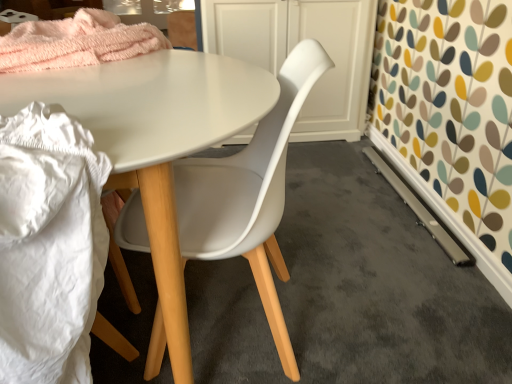
Question: Is white plastic chair at center positioned with its back to white matte cabinet at center?

Choices:
 (A) no
 (B) yes

Answer: (A)

Question: Is white plastic chair at center not near white matte cabinet at center?

Choices:
 (A) yes
 (B) no

Answer: (A)

Question: From the image's perspective, is white plastic chair at center above white matte cabinet at center?

Choices:
 (A) no
 (B) yes

Answer: (A)

Question: Does white plastic chair at center come in front of white matte cabinet at center?

Choices:
 (A) yes
 (B) no

Answer: (A)

Question: Considering the relative sizes of white plastic chair at center and white matte cabinet at center in the image provided, is white plastic chair at center smaller than white matte cabinet at center?

Choices:
 (A) yes
 (B) no

Answer: (A)

Question: Is white matte cabinet at center spatially inside white fabric at lower left, or outside of it?

Choices:
 (A) outside
 (B) inside

Answer: (A)

Question: Is point (323, 1) positioned closer to the camera than point (98, 160)?

Choices:
 (A) closer
 (B) farther

Answer: (B)

Question: Looking at the image, does white matte cabinet at center seem bigger or smaller compared to white fabric at lower left?

Choices:
 (A) big
 (B) small

Answer: (A)

Question: Is white matte cabinet at center wider or thinner than white fabric at lower left?

Choices:
 (A) thin
 (B) wide

Answer: (A)

Question: Considering the positions of white plastic chair at center and white fabric at lower left in the image, is white plastic chair at center wider or thinner than white fabric at lower left?

Choices:
 (A) thin
 (B) wide

Answer: (A)

Question: From a real-world perspective, is white plastic chair at center positioned above or below white fabric at lower left?

Choices:
 (A) above
 (B) below

Answer: (B)

Question: Is white plastic chair at center situated inside white fabric at lower left or outside?

Choices:
 (A) inside
 (B) outside

Answer: (B)

Question: Is white plastic chair at center bigger or smaller than white fabric at lower left?

Choices:
 (A) small
 (B) big

Answer: (B)

Question: Is white matte cabinet at center wider or thinner than white plastic chair at center?

Choices:
 (A) thin
 (B) wide

Answer: (A)

Question: From a real-world perspective, is white matte cabinet at center physically located above or below white plastic chair at center?

Choices:
 (A) below
 (B) above

Answer: (A)